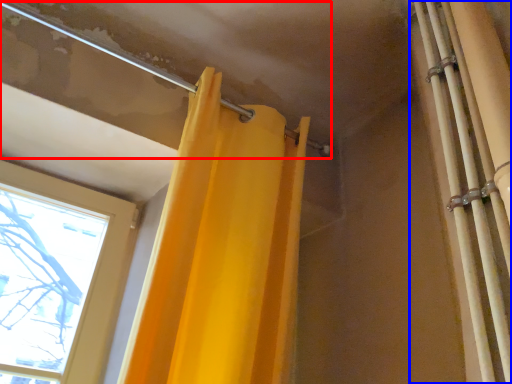
Question: Which of the following is the farthest to the observer, pipe (highlighted by a red box) or shower curtain (highlighted by a blue box)?

Choices:
 (A) pipe
 (B) shower curtain

Answer: (A)